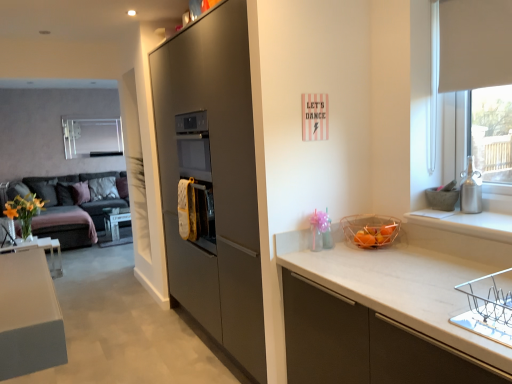
What do you see at coordinates (80, 192) in the screenshot?
I see `matte gray pillow at left, which is counted as the 2th pillow, starting from the right` at bounding box center [80, 192].

The height and width of the screenshot is (384, 512). What do you see at coordinates (212, 178) in the screenshot?
I see `matte gray cabinet at center` at bounding box center [212, 178].

The height and width of the screenshot is (384, 512). I want to click on white fabric pillow at left, which is the 2th pillow from left to right, so click(x=103, y=188).

Locate an element on the screen. This screenshot has width=512, height=384. matte gray pillow at left, which is counted as the 2th pillow, starting from the right is located at coordinates (80, 192).

Which object is thinner, satin silver vase at right or matte gray cabinet at center?

Thinner between the two is satin silver vase at right.

From the image's perspective, is satin silver vase at right on matte gray cabinet at center?

Correct, satin silver vase at right appears higher than matte gray cabinet at center in the image.

Could matte gray cabinet at center be considered to be inside satin silver vase at right?

That's incorrect, matte gray cabinet at center is not inside satin silver vase at right.

From the picture: Which point is more forward, [384,243] or [75,221]?

Point [384,243]

In the scene shown: From the image's perspective, which is above, translucent plastic basket at right or dark gray fabric couch at left?

dark gray fabric couch at left is shown above in the image.

Considering their positions, is translucent plastic basket at right located in front of or behind dark gray fabric couch at left?

translucent plastic basket at right is in front of dark gray fabric couch at left.

Is translucent plastic basket at right not within dark gray fabric couch at left?

Absolutely, translucent plastic basket at right is external to dark gray fabric couch at left.

Is point (111, 189) farther from viewer compared to point (30, 200)?

That is True.

You are a GUI agent. You are given a task and a screenshot of the screen. Output one action in this format:
    pyautogui.click(x=<x>, y=<y>)
    Task: Click on the pillow that is the 2nd object to the right of the yellow matte vase at left, starting at the anchor
    Image resolution: width=512 pixels, height=384 pixels.
    Given the screenshot: What is the action you would take?
    pyautogui.click(x=103, y=188)

From a real-world perspective, is white fabric pillow at left, which is the 2th pillow from left to right, on top of yellow matte vase at left?

Actually, white fabric pillow at left, which is the 2th pillow from left to right, is physically below yellow matte vase at left in the real world.

Is the surface of yellow matte vase at left in direct contact with dark gray fabric couch at left?

No, yellow matte vase at left is not in contact with dark gray fabric couch at left.

Identify the location of studio couch beneath the yellow matte vase at left (from a real-world perspective). Image resolution: width=512 pixels, height=384 pixels. (x=69, y=209).

From the image's perspective, is yellow matte vase at left under dark gray fabric couch at left?

No.

Is yellow matte vase at left to the left of dark gray fabric couch at left from the viewer's perspective?

Correct, you'll find yellow matte vase at left to the left of dark gray fabric couch at left.

Does yellow matte vase at left have a larger size compared to white fabric pillow at left, which ranks as the 1th pillow in right-to-left order?

Indeed, yellow matte vase at left has a larger size compared to white fabric pillow at left, which ranks as the 1th pillow in right-to-left order.

Is point (31, 213) more distant than point (115, 197)?

No, it is not.

Does yellow matte vase at left have a greater height compared to white fabric pillow at left, which ranks as the 1th pillow in right-to-left order?

Indeed, yellow matte vase at left has a greater height compared to white fabric pillow at left, which ranks as the 1th pillow in right-to-left order.

Considering the positions of objects yellow matte vase at left and white fabric pillow at left, which is the 2th pillow from left to right, in the image provided, who is behind, yellow matte vase at left or white fabric pillow at left, which is the 2th pillow from left to right,?

white fabric pillow at left, which is the 2th pillow from left to right, is further away from the camera.

From the image's perspective, between dark gray fabric couch at left and satin silver vase at right, who is located below?

dark gray fabric couch at left, from the image's perspective.

Consider the image. Is dark gray fabric couch at left taller or shorter than satin silver vase at right?

Clearly, dark gray fabric couch at left is taller compared to satin silver vase at right.

Which is behind, dark gray fabric couch at left or satin silver vase at right?

dark gray fabric couch at left is behind.

Locate an element on the screen. studio couch that is behind the satin silver vase at right is located at coordinates (69, 209).

Considering the relative sizes of translucent plastic basket at right and yellow matte vase at left in the image provided, is translucent plastic basket at right taller than yellow matte vase at left?

No.

Which object is further away from the camera taking this photo, translucent plastic basket at right or yellow matte vase at left?

yellow matte vase at left is more distant.

Locate an element on the screen. The height and width of the screenshot is (384, 512). basket in front of the yellow matte vase at left is located at coordinates (370, 230).

Where is `cabinetry behind the satin silver vase at right`? Image resolution: width=512 pixels, height=384 pixels. cabinetry behind the satin silver vase at right is located at coordinates (212, 178).

Locate an element on the screen. This screenshot has width=512, height=384. studio couch directly beneath the translucent plastic basket at right (from a real-world perspective) is located at coordinates (69, 209).

Estimate the real-world distances between objects in this image. Which object is further from satin silver vase at right, yellow matte vase at left or white fabric pillow at left, which ranks as the 1th pillow in right-to-left order?

The object further to satin silver vase at right is white fabric pillow at left, which ranks as the 1th pillow in right-to-left order.

When comparing their distances from dark gray fabric couch at left, does yellow matte vase at left or matte gray cabinet at center seem further?

matte gray cabinet at center is further to dark gray fabric couch at left.

Based on their spatial positions, is yellow matte vase at left or satin silver vase at right further from white fabric pillow at left, which ranks as the 1th pillow in right-to-left order?

satin silver vase at right lies further to white fabric pillow at left, which ranks as the 1th pillow in right-to-left order, than the other object.

When comparing their distances from dark gray fabric couch at left, does white fabric pillow at left, which is the 2th pillow from left to right, or satin silver vase at right seem closer?

The object closer to dark gray fabric couch at left is white fabric pillow at left, which is the 2th pillow from left to right.

Estimate the real-world distances between objects in this image. Which object is further from yellow matte vase at left, dark gray fabric couch at left or translucent plastic basket at right?

The object further to yellow matte vase at left is translucent plastic basket at right.

Looking at the image, which one is located further to translucent plastic basket at right, yellow matte vase at left or matte gray pillow at left, placed as the 1th pillow when sorted from left to right?

matte gray pillow at left, placed as the 1th pillow when sorted from left to right, lies further to translucent plastic basket at right than the other object.

Considering their positions, is white fabric pillow at left, which is the 2th pillow from left to right, positioned further to matte gray cabinet at center than yellow matte vase at left?

white fabric pillow at left, which is the 2th pillow from left to right, lies further to matte gray cabinet at center than the other object.

Estimate the real-world distances between objects in this image. Which object is further from matte gray cabinet at center, yellow matte vase at left or satin silver vase at right?

yellow matte vase at left is further to matte gray cabinet at center.

Where is `studio couch between matte gray cabinet at center and white fabric pillow at left, which is the 2th pillow from left to right, in the front-back direction`? studio couch between matte gray cabinet at center and white fabric pillow at left, which is the 2th pillow from left to right, in the front-back direction is located at coordinates (69, 209).

Image resolution: width=512 pixels, height=384 pixels. I want to click on flower positioned between satin silver vase at right and matte gray pillow at left, placed as the 1th pillow when sorted from left to right, from near to far, so click(24, 207).

Where is `flower between translucent plastic basket at right and matte gray pillow at left, placed as the 1th pillow when sorted from left to right, along the z-axis`? flower between translucent plastic basket at right and matte gray pillow at left, placed as the 1th pillow when sorted from left to right, along the z-axis is located at coordinates (24, 207).

The width and height of the screenshot is (512, 384). What are the coordinates of `flower located between dark gray fabric couch at left and white fabric pillow at left, which ranks as the 1th pillow in right-to-left order, in the depth direction` in the screenshot? It's located at click(x=24, y=207).